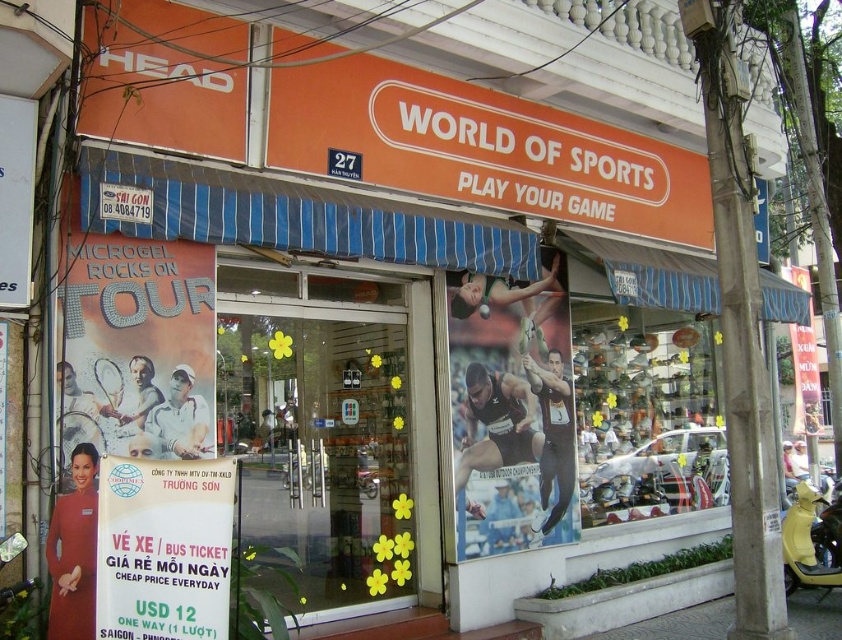
You are a customer standing in front of the World of Sports store. You see two posters on the left side of the entrance. The first one is a matte black poster at center and the other is a yellow paper poster at left. Which poster is closer to the entrance?

The yellow paper poster at left is closer to the entrance because the matte black poster at center is positioned on the right side of it.

You are standing in front of the World of Sports store. You want to find the yellow paper poster at left. Where should you look relative to the store entrance?

The yellow paper poster at left is located at the left side of the store entrance, positioned at coordinates approximately 0.542 on the x and 0.164 on the y axis.